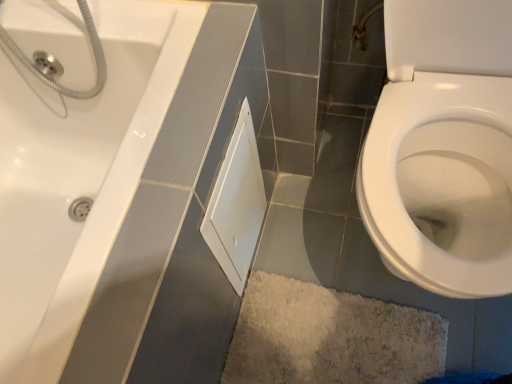
Question: Does white matte cabinet at center lie in front of white glossy bidet at lower right?

Choices:
 (A) no
 (B) yes

Answer: (A)

Question: Can you confirm if white matte cabinet at center is thinner than white glossy bidet at lower right?

Choices:
 (A) no
 (B) yes

Answer: (B)

Question: Is white matte cabinet at center at the right side of white glossy bidet at lower right?

Choices:
 (A) no
 (B) yes

Answer: (A)

Question: Considering the relative sizes of white matte cabinet at center and white glossy bidet at lower right in the image provided, is white matte cabinet at center smaller than white glossy bidet at lower right?

Choices:
 (A) no
 (B) yes

Answer: (B)

Question: Is white matte cabinet at center outside white glossy bidet at lower right?

Choices:
 (A) yes
 (B) no

Answer: (A)

Question: Is white matte cabinet at center further to camera compared to white glossy bidet at lower right?

Choices:
 (A) no
 (B) yes

Answer: (B)

Question: Does white glossy bidet at lower right have a greater height compared to white matte cabinet at center?

Choices:
 (A) yes
 (B) no

Answer: (A)

Question: Is the depth of white glossy bidet at lower right greater than that of white matte cabinet at center?

Choices:
 (A) no
 (B) yes

Answer: (A)

Question: Does white glossy bidet at lower right have a smaller size compared to white matte cabinet at center?

Choices:
 (A) yes
 (B) no

Answer: (B)

Question: Can you confirm if white glossy bidet at lower right is wider than white matte cabinet at center?

Choices:
 (A) yes
 (B) no

Answer: (A)

Question: Can you confirm if white glossy bidet at lower right is positioned to the left of white matte cabinet at center?

Choices:
 (A) no
 (B) yes

Answer: (A)

Question: Considering the relative positions of white glossy bidet at lower right and white matte cabinet at center in the image provided, is white glossy bidet at lower right to the right of white matte cabinet at center from the viewer's perspective?

Choices:
 (A) yes
 (B) no

Answer: (A)

Question: Does point (256, 163) appear closer or farther from the camera than point (503, 233)?

Choices:
 (A) farther
 (B) closer

Answer: (A)